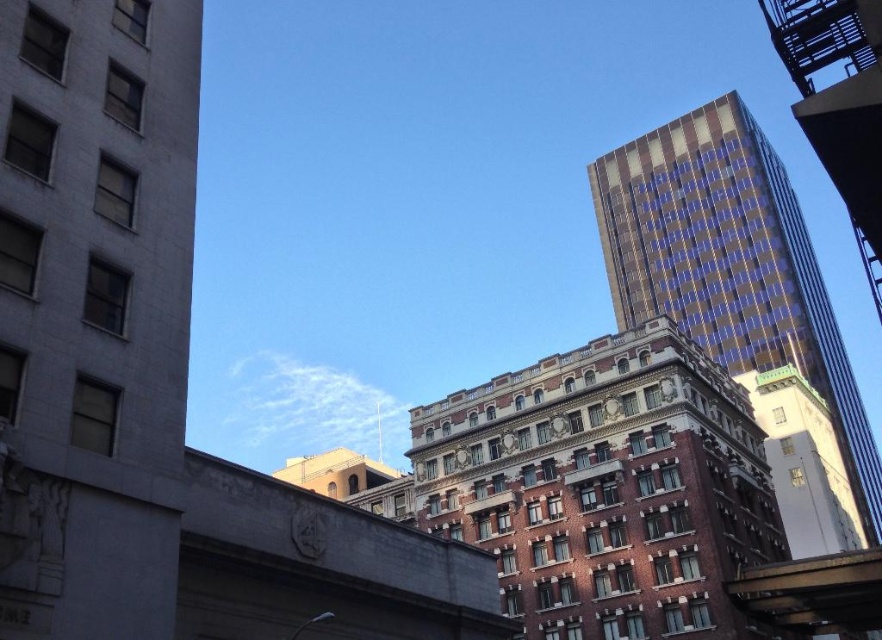
Can you confirm if gray concrete building at left is positioned to the left of gold and blue glass skyscraper at upper right?

Indeed, gray concrete building at left is positioned on the left side of gold and blue glass skyscraper at upper right.

Is point (121, 336) positioned before point (662, 284)?

Yes, it is.

Locate an element on the screen. gray concrete building at left is located at coordinates (94, 310).